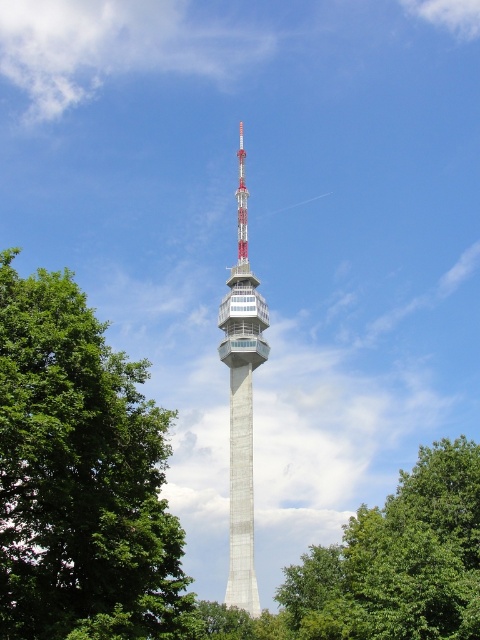
Can you confirm if green leafy tree at left is bigger than concrete tower at center?

Correct, green leafy tree at left is larger in size than concrete tower at center.

Is point (99, 356) closer to camera compared to point (260, 342)?

Yes, point (99, 356) is in front of point (260, 342).

Is point (62, 504) farther from viewer compared to point (257, 344)?

No.

In order to click on green leafy tree at left in this screenshot , I will do `click(81, 477)`.

Does point (151, 620) come closer to viewer compared to point (380, 576)?

Yes.

Where is `green leafy tree at left`? The height and width of the screenshot is (640, 480). green leafy tree at left is located at coordinates (81, 477).

What are the coordinates of `green leafy tree at left` in the screenshot? It's located at (81, 477).

Is green leafy tree at center above concrete tower at center?

Incorrect, green leafy tree at center is not positioned above concrete tower at center.

Is point (460, 522) in front of point (238, 452)?

Yes, it is in front of point (238, 452).

I want to click on green leafy tree at center, so click(398, 560).